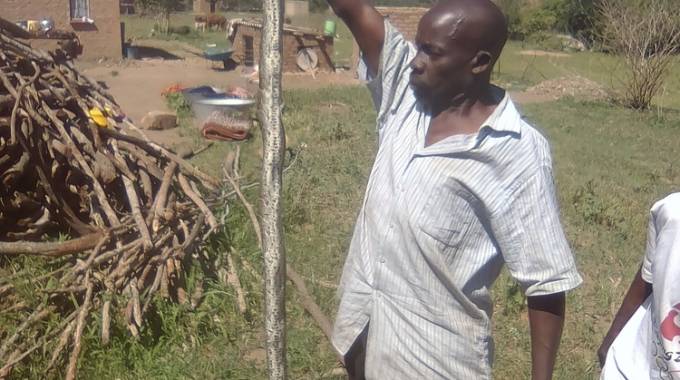
Locate an element on the screen. The image size is (680, 380). tub is located at coordinates (224, 119).